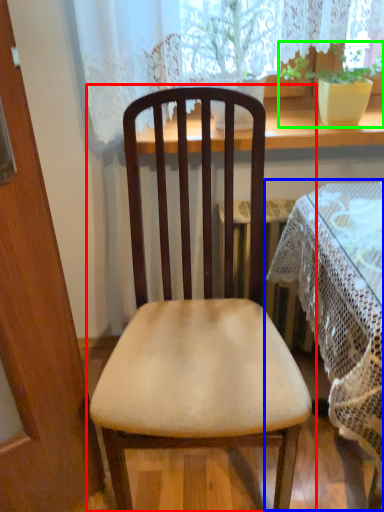
Question: Which object is positioned farthest from chair (highlighted by a red box)? Select from table (highlighted by a blue box) and houseplant (highlighted by a green box).

Choices:
 (A) table
 (B) houseplant

Answer: (B)